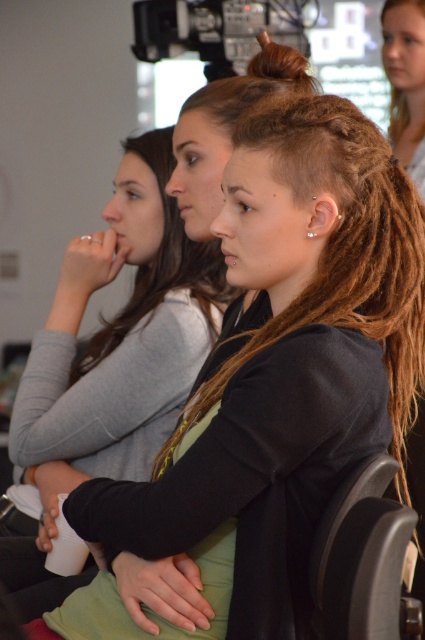
Which is behind, point (193, 337) or point (365, 538)?

The point (193, 337) is more distant.

Who is shorter, black matte shirt at center or black leather chair at lower right?

black leather chair at lower right is shorter.

Does point (107, 280) come closer to viewer compared to point (391, 508)?

No, (107, 280) is behind (391, 508).

Locate an element on the screen. This screenshot has height=640, width=425. black matte shirt at center is located at coordinates (x=122, y=330).

Is brown/dry/dreadlocks at center to the left of brown hair at upper center from the viewer's perspective?

No, brown/dry/dreadlocks at center is not to the left of brown hair at upper center.

Is point (371, 294) farther from viewer compared to point (308, 88)?

No, (371, 294) is in front of (308, 88).

The width and height of the screenshot is (425, 640). I want to click on brown/dry/dreadlocks at center, so click(342, 248).

Is black matte shirt at center thinner than brown/dry hair at center?

No, black matte shirt at center is not thinner than brown/dry hair at center.

Does black matte shirt at center have a lesser height compared to brown/dry hair at center?

Incorrect, black matte shirt at center's height does not fall short of brown/dry hair at center's.

At what (x,y) coordinates should I click in order to perform the action: click on black matte shirt at center. Please return your answer as a coordinate pair (x, y). The image size is (425, 640). Looking at the image, I should click on (122, 330).

You are a GUI agent. You are given a task and a screenshot of the screen. Output one action in this format:
    pyautogui.click(x=<x>, y=<y>)
    Task: Click on the black matte shirt at center
    Image resolution: width=425 pixels, height=640 pixels.
    Given the screenshot: What is the action you would take?
    pyautogui.click(x=122, y=330)